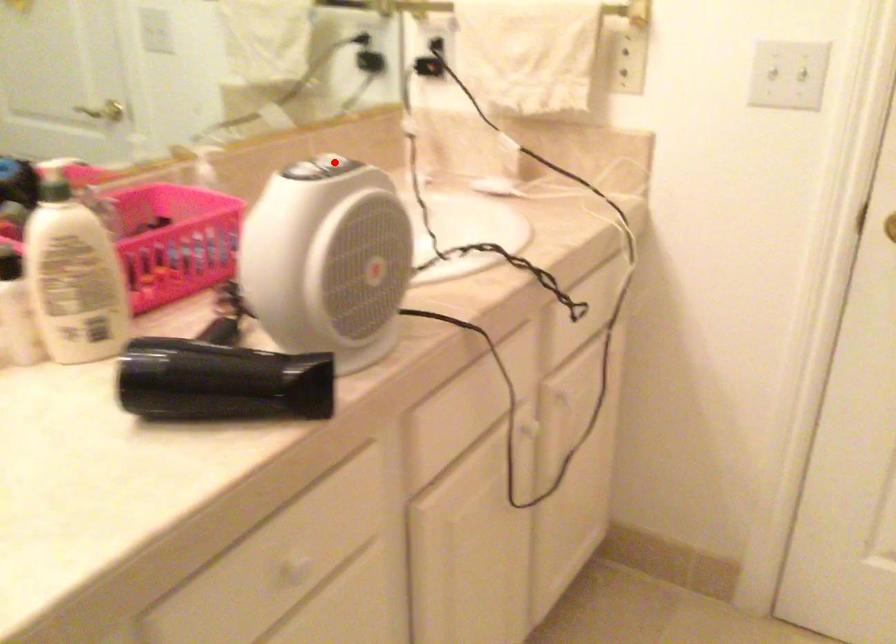
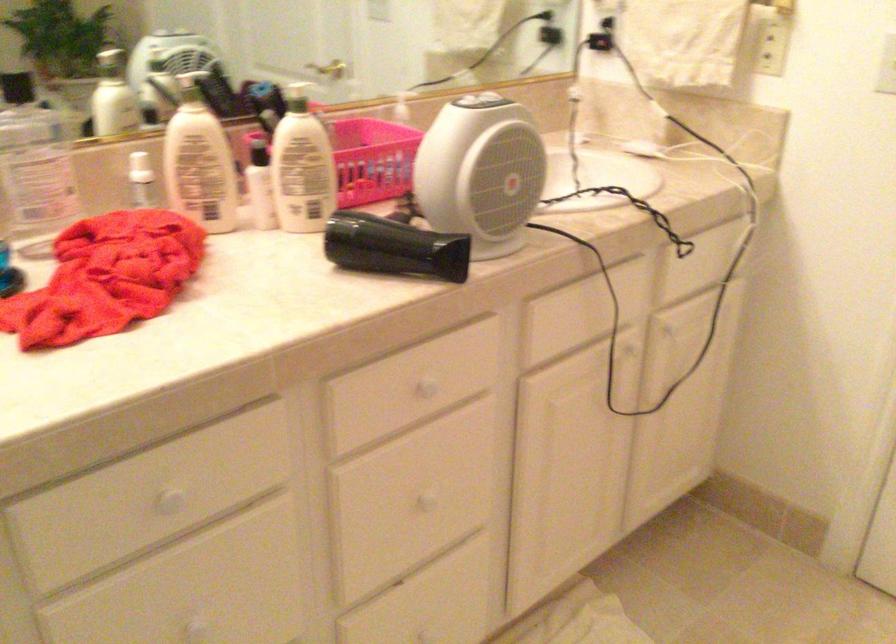
Question: I am providing you with two images of the same scene from different viewpoints. A red point is shown in image1. For the corresponding object point in image2, is it positioned nearer or farther from the camera?

Choices:
 (A) Nearer
 (B) Farther

Answer: (B)